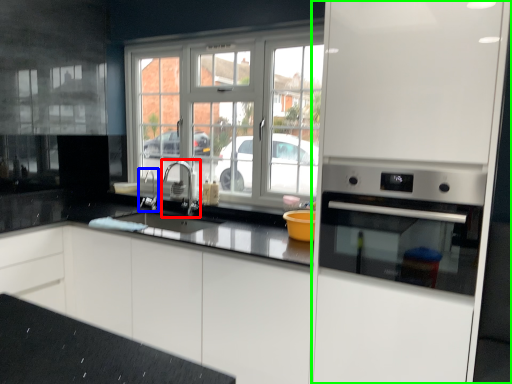
Question: Which object is positioned farthest from tap (highlighted by a red box)? Select from faucet (highlighted by a blue box) and appliance (highlighted by a green box).

Choices:
 (A) faucet
 (B) appliance

Answer: (B)